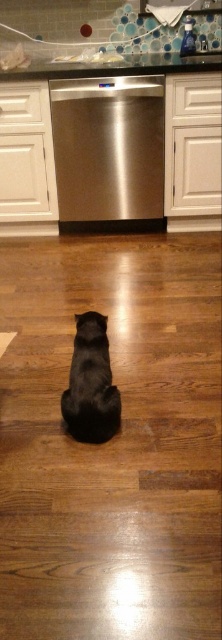
In the scene shown: You are standing in the kitchen and want to reach the point at coordinates point (144, 170). If you can walk 1.5 meters in 1 second, how long will it take you to reach that point?

The distance of point (144, 170) from camera is 3.08 meters. At a walking speed of 1.5 meters per second, it would take approximately 2.05 seconds to reach the point.

You are a delivery person who just arrived at the house. You see the shiny black cat at center and the glassy countertop at upper center. Which object is closer to the floor?

The shiny black cat at center is closer to the floor because it is below the glassy countertop at upper center.

You are a photographer trying to capture a clear shot of the shiny black cat at center and the glassy countertop at upper center. Since you want both subjects in focus, which one should you adjust your camera focus on first?

You should focus on the shiny black cat at center first because it is closer to the viewer than the glassy countertop at upper center, ensuring both are in focus by starting with the nearer subject.